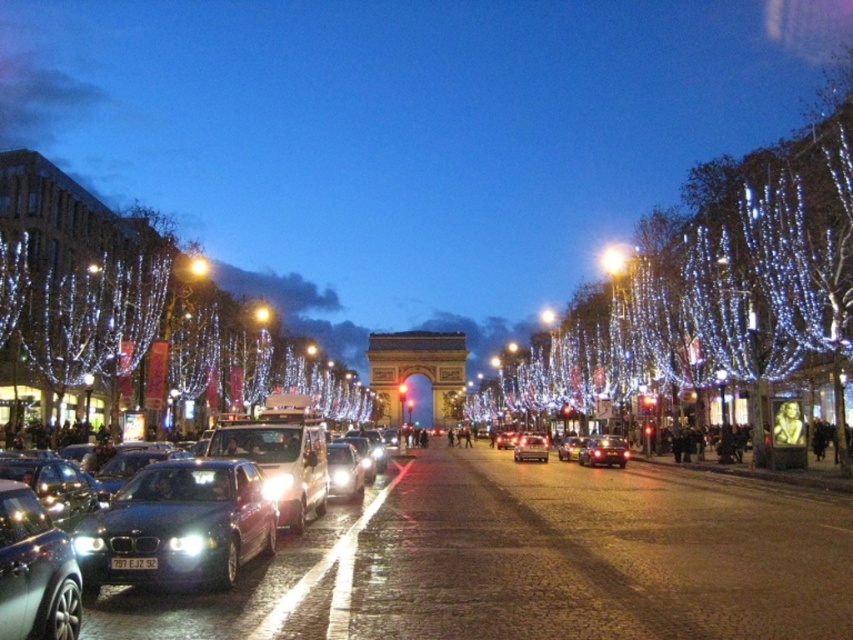
The height and width of the screenshot is (640, 853). I want to click on satin silver sedan at center, so click(531, 448).

Which is more to the left, satin silver sedan at center or bright yellow streetlight at center?

satin silver sedan at center

Who is more forward, (525, 438) or (614, 259)?

Point (525, 438) is more forward.

Find the location of a particular element. Image resolution: width=853 pixels, height=640 pixels. satin silver sedan at center is located at coordinates (531, 448).

Between sleek metallic car at center and shiny silver car at center, which one has less height?

Standing shorter between the two is sleek metallic car at center.

Can you confirm if sleek metallic car at center is shorter than shiny silver car at center?

Yes, sleek metallic car at center is shorter than shiny silver car at center.

Image resolution: width=853 pixels, height=640 pixels. Find the location of `sleek metallic car at center`. sleek metallic car at center is located at coordinates (241, 586).

Can you confirm if shiny silver car at lower left is bigger than bright yellow streetlight at center?

No.

Which is more to the right, shiny silver car at lower left or bright yellow streetlight at center?

bright yellow streetlight at center

The width and height of the screenshot is (853, 640). Identify the location of shiny silver car at lower left. (35, 570).